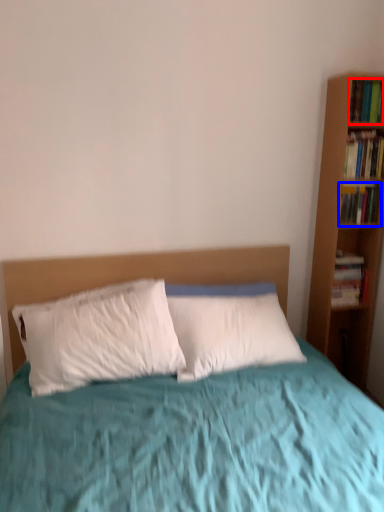
Question: Which object appears farthest to the camera in this image, book (highlighted by a red box) or book (highlighted by a blue box)?

Choices:
 (A) book
 (B) book

Answer: (B)